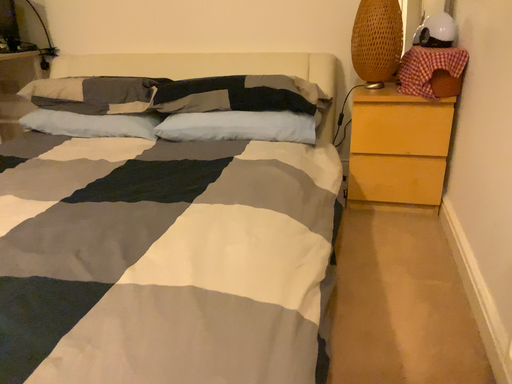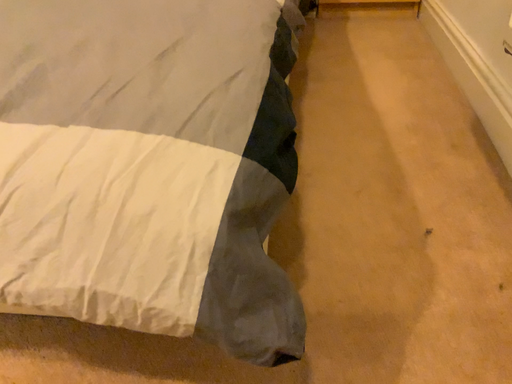
Question: Which way did the camera rotate in the video?

Choices:
 (A) rotated downward
 (B) rotated upward

Answer: (A)